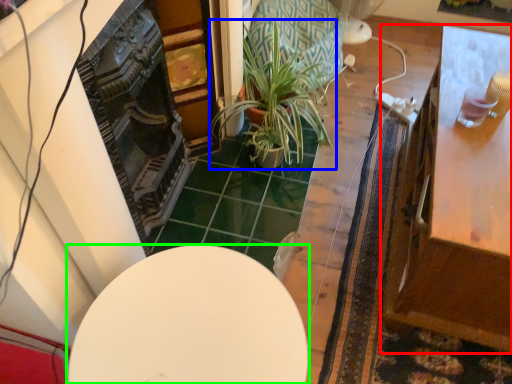
Question: Which object is positioned farthest from table (highlighted by a red box)? Select from houseplant (highlighted by a blue box) and table (highlighted by a green box).

Choices:
 (A) houseplant
 (B) table

Answer: (A)